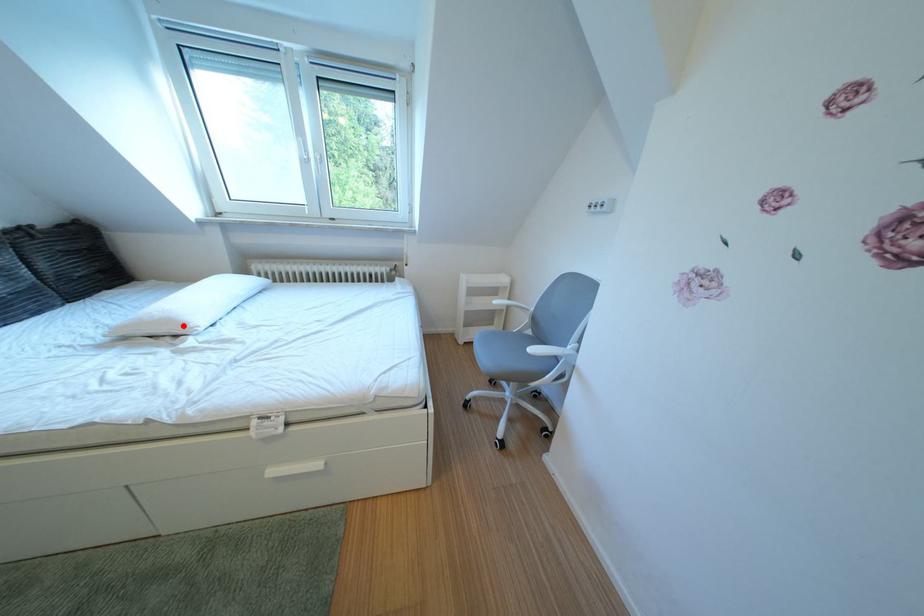
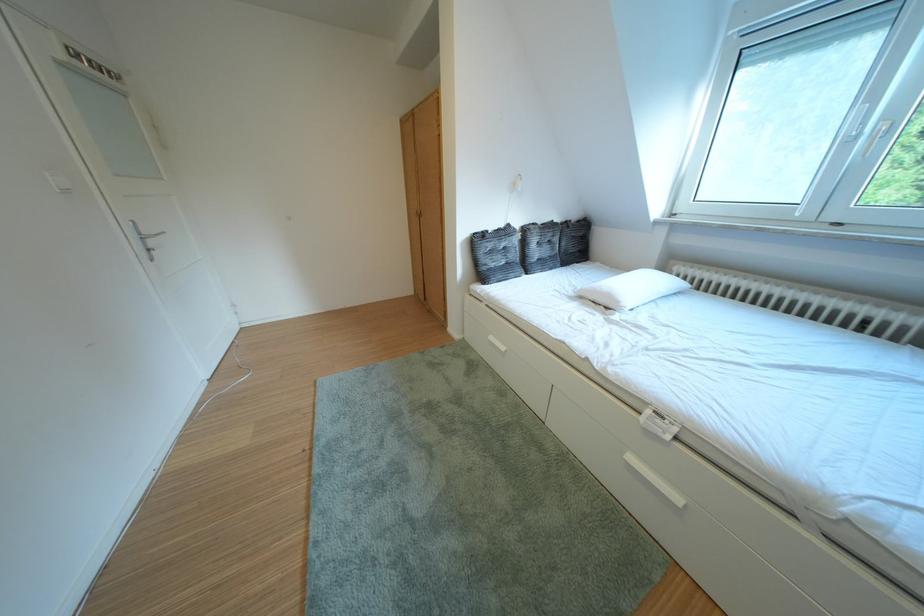
Locate, in the second image, the point that corresponds to the highlighted location in the first image.

(623, 301)